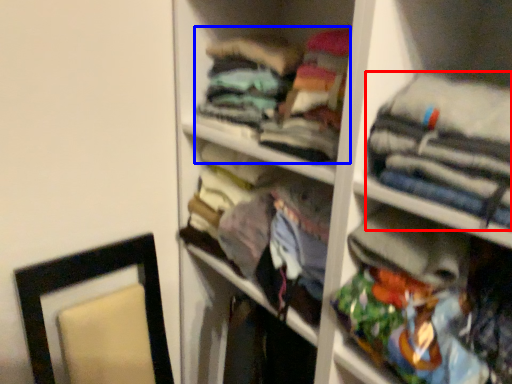
Question: Which object is further to the camera taking this photo, clothing (highlighted by a red box) or clothing (highlighted by a blue box)?

Choices:
 (A) clothing
 (B) clothing

Answer: (B)